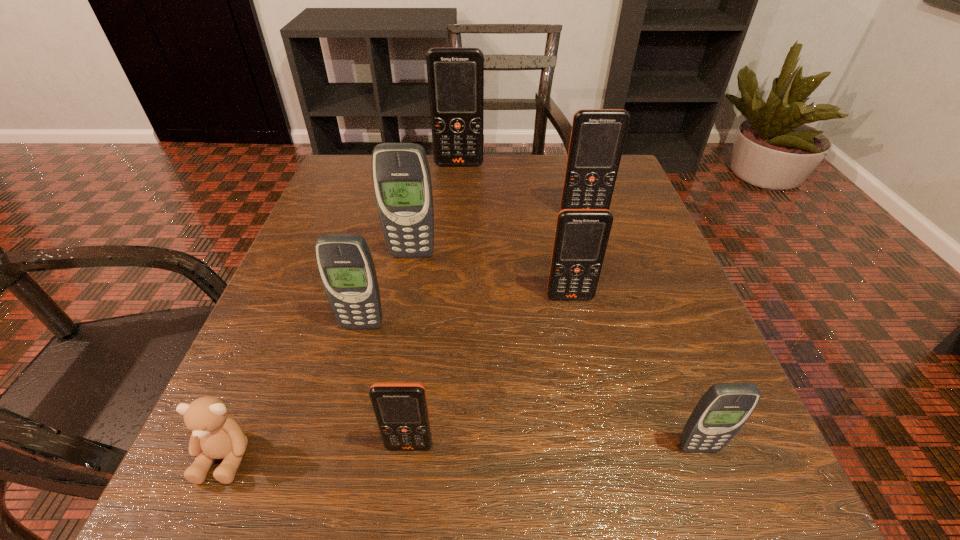
Locate an element on the screen. The width and height of the screenshot is (960, 540). cellular telephone that stands as the fourth closest to the nearest orange cellular telephone is located at coordinates (401, 176).

Identify which cellular telephone is located as the nearest to the second biggest gray cellular telephone. Please provide its 2D coordinates. Your answer should be formatted as a tuple, i.e. [(x, y)], where the tuple contains the x and y coordinates of a point satisfying the conditions above.

[(401, 176)]

The image size is (960, 540). Find the location of `orange cellular telephone identified as the closest to the fourth farthest cellular telephone`. orange cellular telephone identified as the closest to the fourth farthest cellular telephone is located at coordinates (597, 139).

Locate which orange cellular telephone is the fourth closest to the brown teddy bear. Please provide its 2D coordinates. Your answer should be formatted as a tuple, i.e. [(x, y)], where the tuple contains the x and y coordinates of a point satisfying the conditions above.

[(455, 75)]

The height and width of the screenshot is (540, 960). Identify the location of gray cellular telephone that can be found as the closest to the smallest gray cellular telephone. (345, 264).

Locate an element on the screen. gray cellular telephone object that ranks as the closest to the biggest gray cellular telephone is located at coordinates (345, 264).